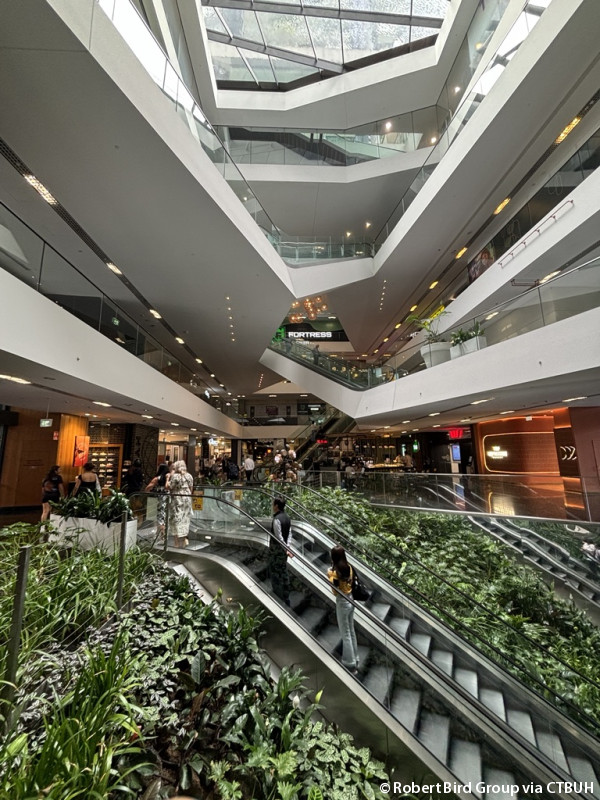
The width and height of the screenshot is (600, 800). What are the coordinates of `white illuinated sign` in the screenshot? It's located at (495, 453).